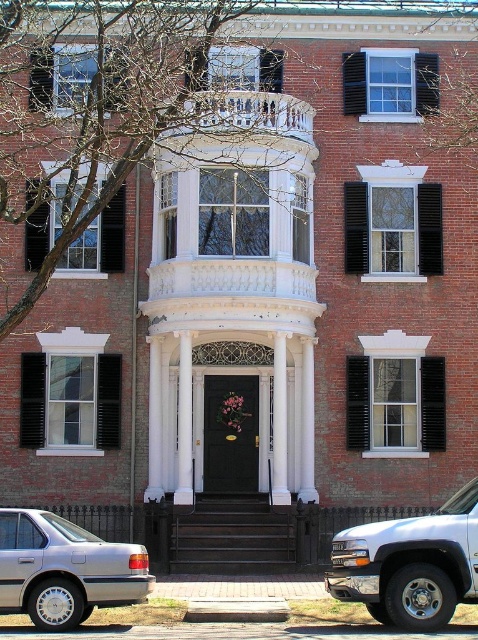
Question: Which of the following is the farthest from the observer?

Choices:
 (A) (463, 579)
 (B) (40, 621)

Answer: (B)

Question: Is white metallic suv at lower right wider than silver metallic sedan at lower left?

Choices:
 (A) yes
 (B) no

Answer: (B)

Question: Is white metallic suv at lower right smaller than silver metallic sedan at lower left?

Choices:
 (A) yes
 (B) no

Answer: (B)

Question: Is white metallic suv at lower right below silver metallic sedan at lower left?

Choices:
 (A) yes
 (B) no

Answer: (A)